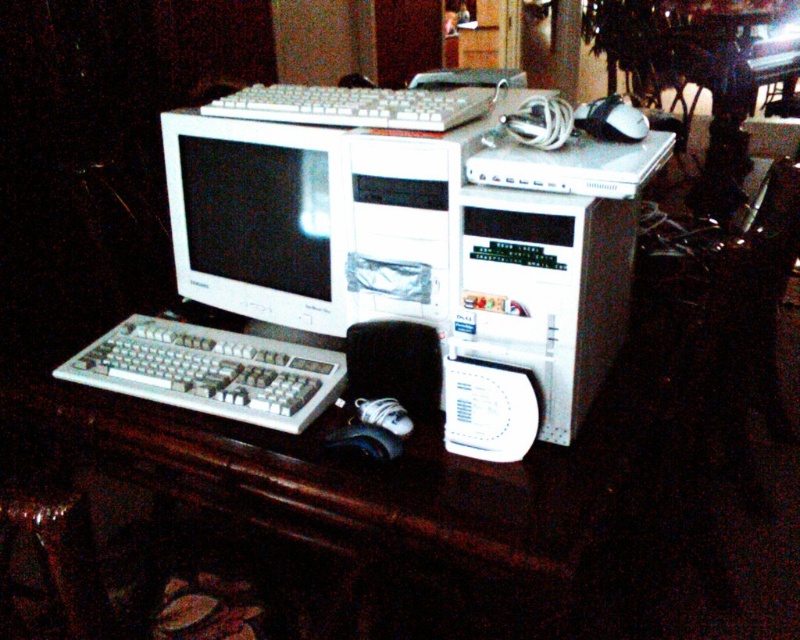
Who is shorter, white plastic keyboard at lower left or black rubber mouse at lower center?

With less height is black rubber mouse at lower center.

Between point (238, 396) and point (385, 456), which one is positioned in front?

Point (385, 456) is more forward.

Identify the location of white plastic keyboard at lower left. The image size is (800, 640). (212, 371).

Is white plastic computer tower at center thinner than white glossy monitor at center?

Yes.

Describe the element at coordinates (544, 292) in the screenshot. I see `white plastic computer tower at center` at that location.

Describe the element at coordinates (544, 292) in the screenshot. I see `white plastic computer tower at center` at that location.

Find the location of `white plastic computer tower at center`. white plastic computer tower at center is located at coordinates (544, 292).

Is white glossy monitor at center above black rubber mouse at lower center?

Yes, white glossy monitor at center is above black rubber mouse at lower center.

Who is more distant from viewer, (282,195) or (329,435)?

Point (282,195)

Is point (197, 120) behind point (336, 448)?

Yes, it is.

What are the coordinates of `white glossy monitor at center` in the screenshot? It's located at (256, 218).